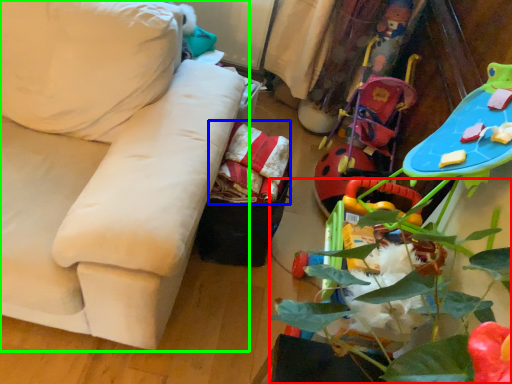
Question: Which is farther away from plant (highlighted by a red box)? material (highlighted by a blue box) or studio couch (highlighted by a green box)?

Choices:
 (A) material
 (B) studio couch

Answer: (B)